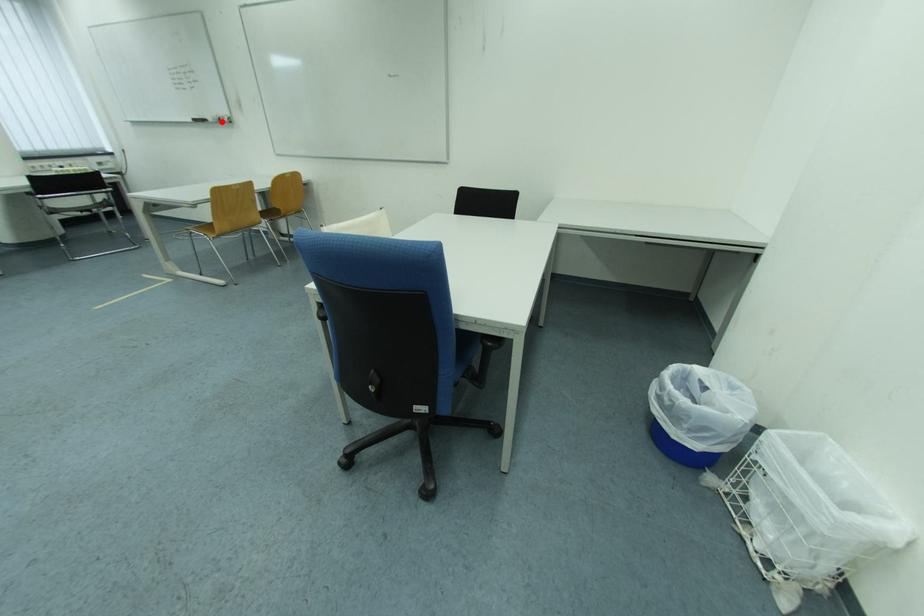
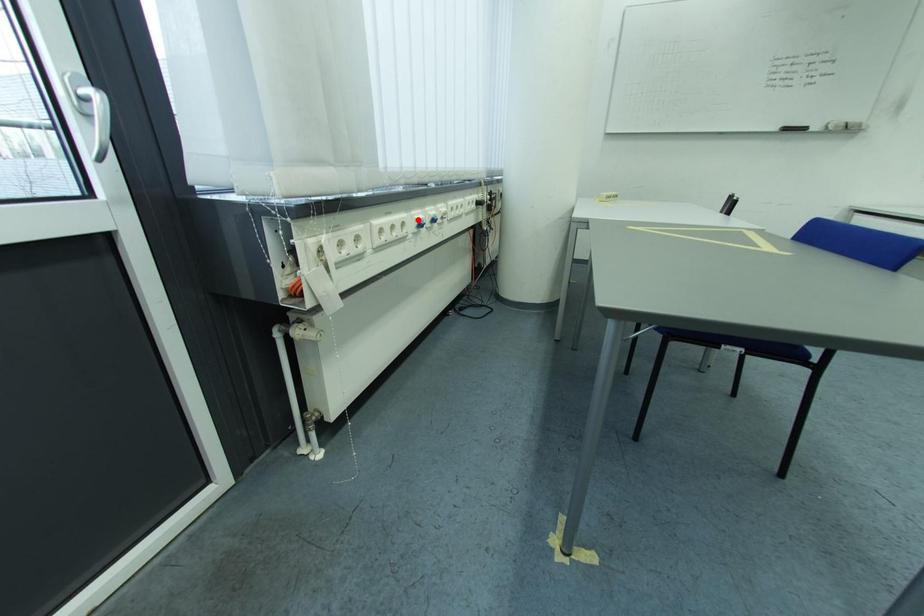
I am providing you with two images of the same scene from different viewpoints. A red point is marked on the first image and another point is marked on the second image. Do the highlighted points in image1 and image2 indicate the same real-world spot?

No